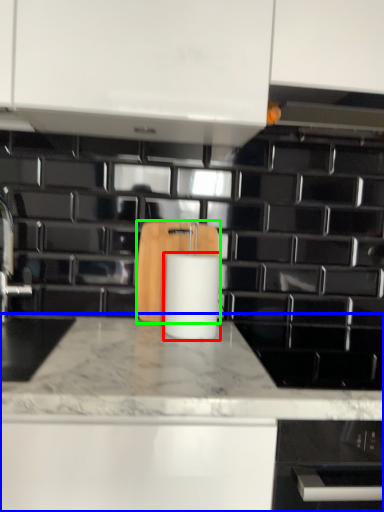
Question: Which object is the closest to the paper towel (highlighted by a red box)? Choose among these: countertop (highlighted by a blue box) or cutting board (highlighted by a green box).

Choices:
 (A) countertop
 (B) cutting board

Answer: (B)